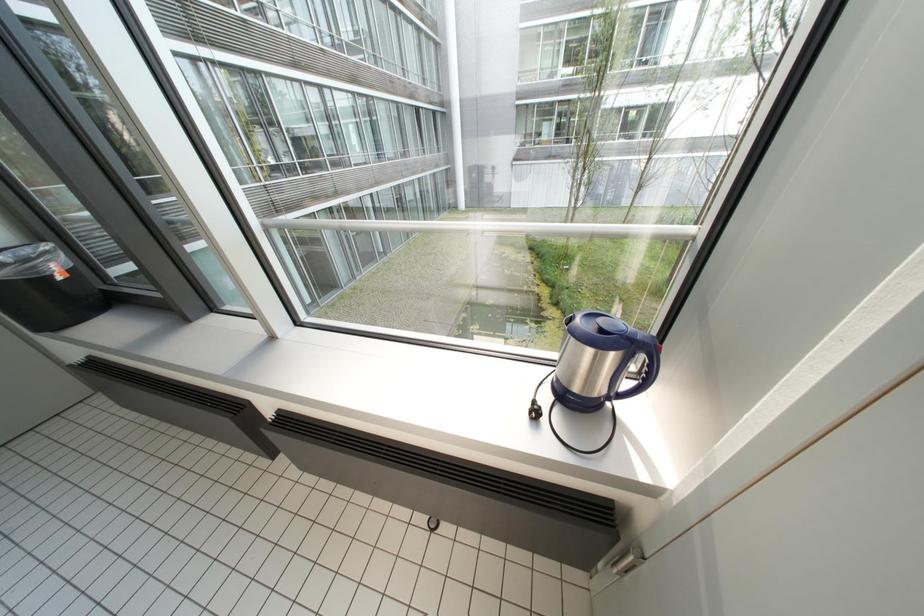
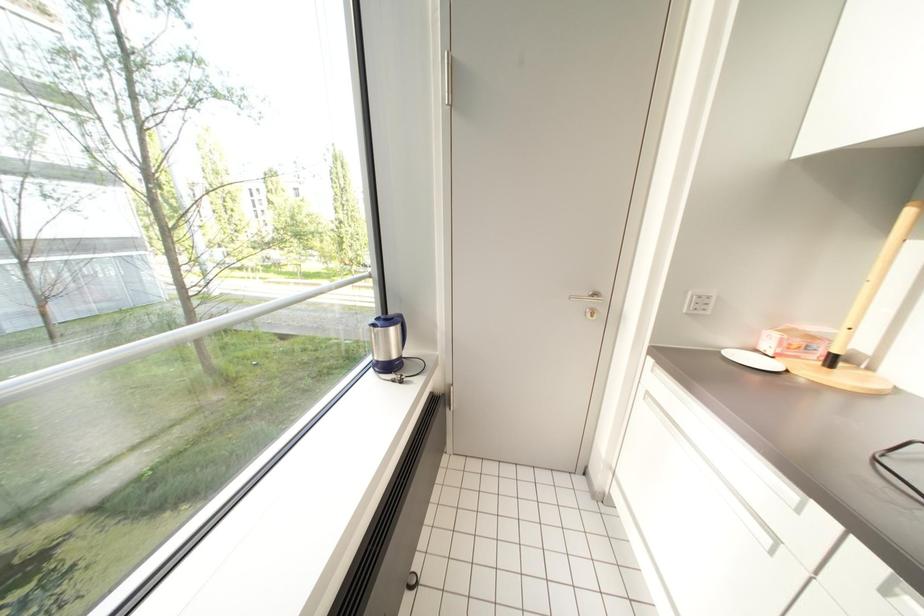
How did the camera likely rotate?

The rotation direction of the camera is right-down.